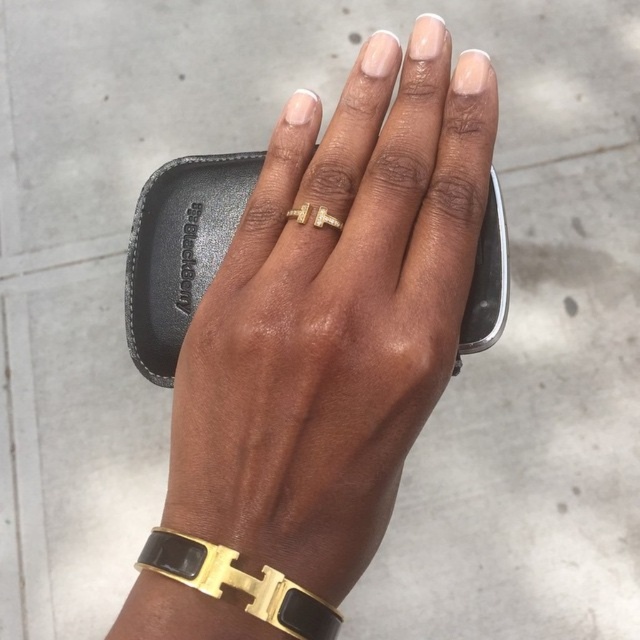
Which is below, gold metallic ring at center or gold diamond ring at center?

gold metallic ring at center is lower down.

Is point (193, 508) less distant than point (291, 209)?

Yes, point (193, 508) is in front of point (291, 209).

Identify the location of gold metallic ring at center. The width and height of the screenshot is (640, 640). (333, 316).

Is gold/black metal/bracelet at lower center to the left of gold diamond ring at center from the viewer's perspective?

Indeed, gold/black metal/bracelet at lower center is positioned on the left side of gold diamond ring at center.

Locate an element on the screen. The width and height of the screenshot is (640, 640). gold/black metal/bracelet at lower center is located at coordinates (237, 582).

At what (x,y) coordinates should I click in order to perform the action: click on gold/black metal/bracelet at lower center. Please return your answer as a coordinate pair (x, y). This screenshot has height=640, width=640. Looking at the image, I should click on (237, 582).

Measure the distance between gold metallic ring at center and gold/black metal/bracelet at lower center.

They are 4.66 inches apart.

Is gold metallic ring at center below gold/black metal/bracelet at lower center?

No.

Does point (262, 406) lie behind point (305, 630)?

Yes, point (262, 406) is behind point (305, 630).

The height and width of the screenshot is (640, 640). Identify the location of gold metallic ring at center. (333, 316).